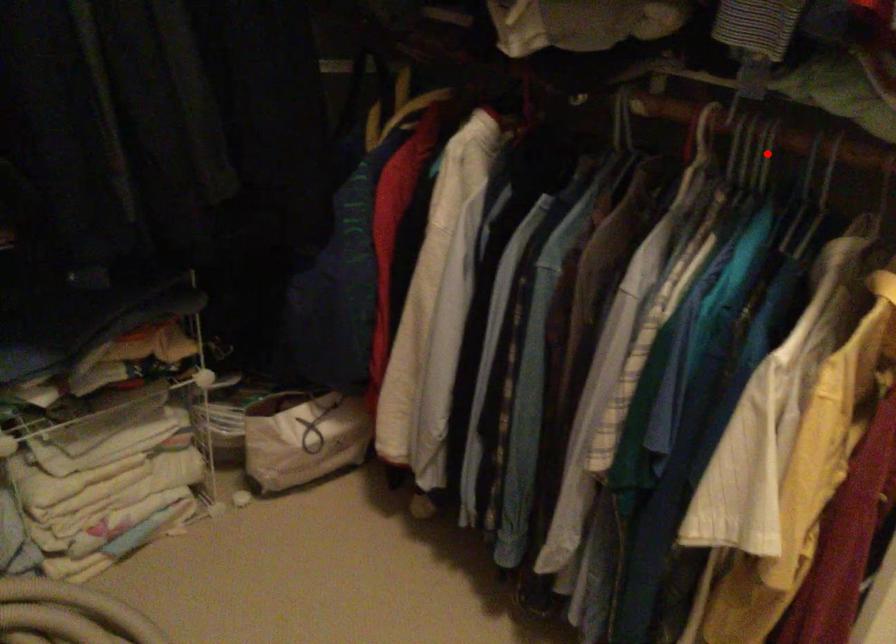
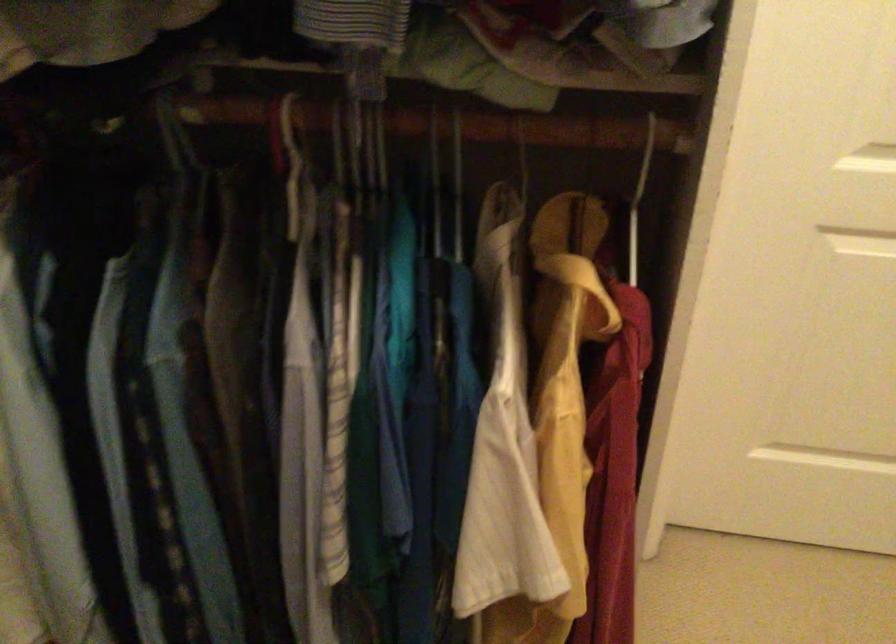
Question: I am providing you with two images of the same scene from different viewpoints. In image1, a red point is highlighted. Considering the same 3D point in image2, which of the following is correct?

Choices:
 (A) It is closer
 (B) It is farther

Answer: (B)